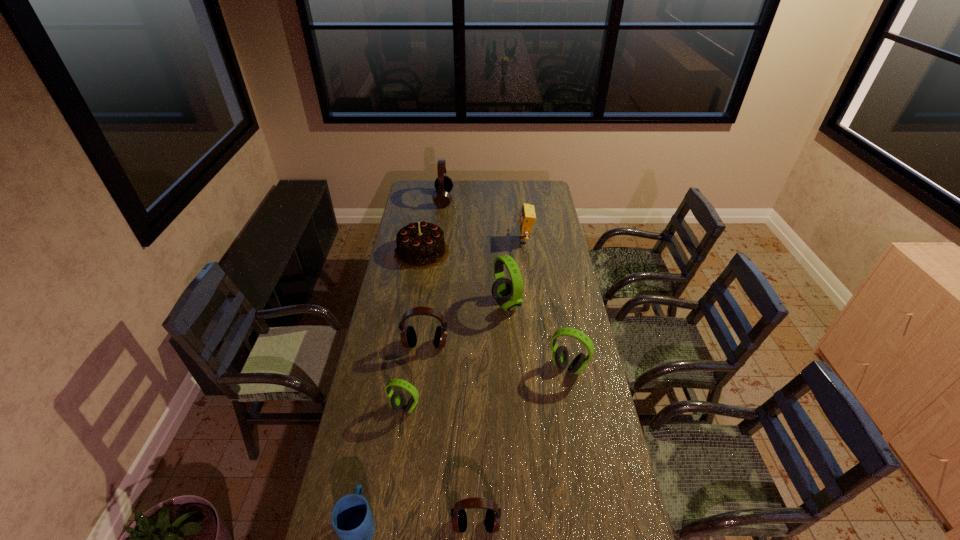
I want to click on the farthest black headset, so click(443, 184).

Locate an element on the screen. The image size is (960, 540). the farthest headset is located at coordinates (443, 184).

The image size is (960, 540). I want to click on the second farthest headset, so (508, 292).

Image resolution: width=960 pixels, height=540 pixels. In order to click on the farthest green headset in this screenshot , I will do `click(508, 292)`.

You are a GUI agent. You are given a task and a screenshot of the screen. Output one action in this format:
    pyautogui.click(x=<x>, y=<y>)
    Task: Click on the second farthest black headset
    Image resolution: width=960 pixels, height=540 pixels.
    Given the screenshot: What is the action you would take?
    pyautogui.click(x=408, y=335)

The height and width of the screenshot is (540, 960). In order to click on the fifth farthest object in this screenshot , I will do `click(408, 335)`.

Locate an element on the screen. This screenshot has width=960, height=540. the second farthest green headset is located at coordinates (560, 356).

Find the location of a particular element. The image size is (960, 540). the fourth farthest headset is located at coordinates (560, 356).

I want to click on sponge, so click(527, 216).

Find the location of a particular element. brown birthday cake is located at coordinates (420, 245).